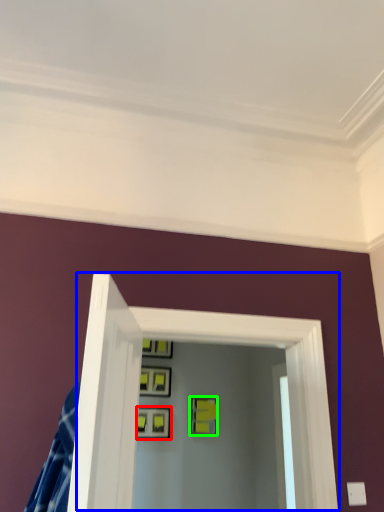
Question: Which object is the farthest from picture frame (highlighted by a red box)? Choose among these: glass door (highlighted by a blue box) or picture frame (highlighted by a green box).

Choices:
 (A) glass door
 (B) picture frame

Answer: (A)